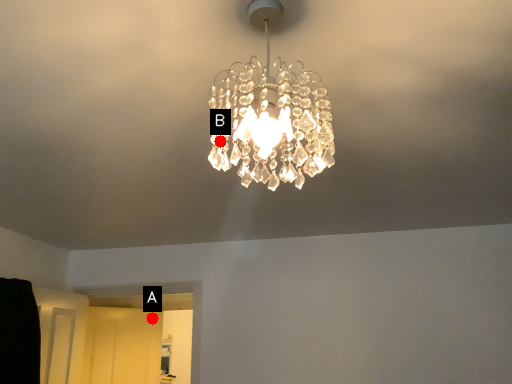
Question: Two points are circled on the image, labeled by A and B beside each circle. Which point is closer to the camera?

Choices:
 (A) A is closer
 (B) B is closer

Answer: (B)